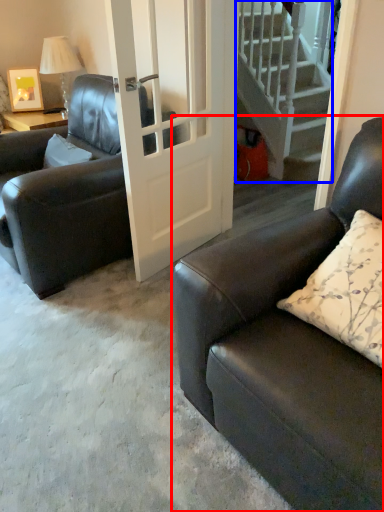
Question: Which object appears farthest to the camera in this image, studio couch (highlighted by a red box) or stairs (highlighted by a blue box)?

Choices:
 (A) studio couch
 (B) stairs

Answer: (B)